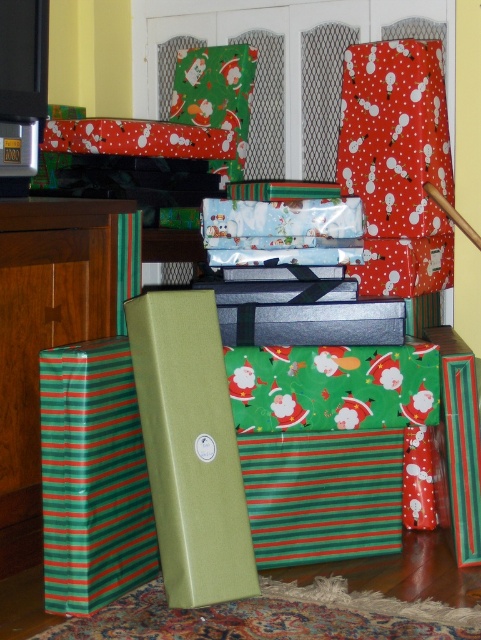
You are standing in the living room and want to pick up the gift located at point (104,497). However, there is another gift at point (26,308) blocking your path. Can you reach the first gift without moving the second one?

Point (104,497) is in front of point (26,308), so you can reach the first gift without moving the second one because it is closer to you.

You are a delivery person who just arrived at the house and see the image. You need to place a new gift on the floor in front of the cabinet. Which object should you place it in front of, the green striped paper at lower left or the green striped box at left?

You should place the new gift in front of the green striped box at left because the green striped paper at lower left is already closer to you than the green striped box at left, meaning the box is farther back. Placing the new gift in front of the box would require it to be closer to the cabinet.

You are organizing gifts in the living room and notice two items with green stripes. One has green striped paper at lower left and the other is a green striped box at left. Which one is positioned lower in the stack?

The green striped paper at lower left is positioned lower in the stack because it is below the green striped box at left.